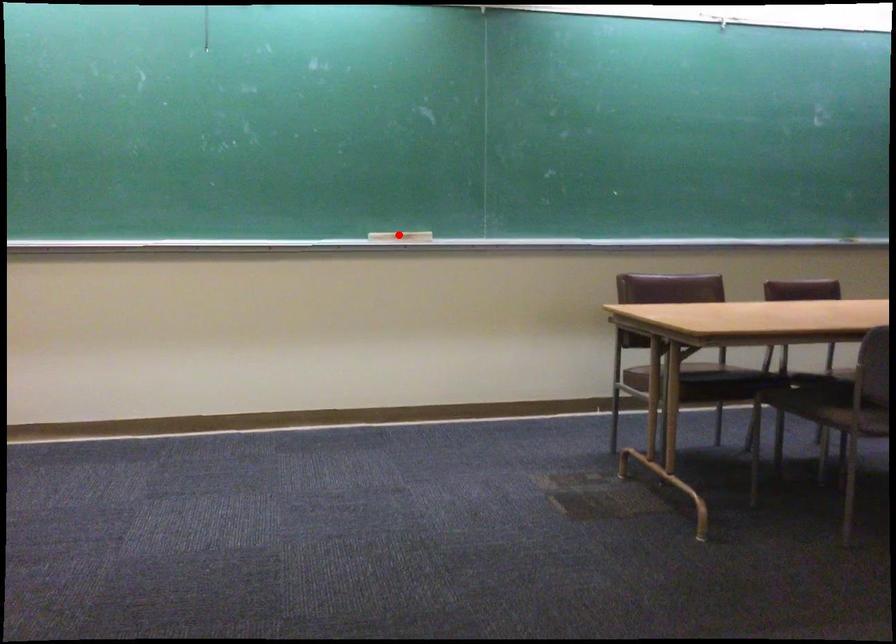
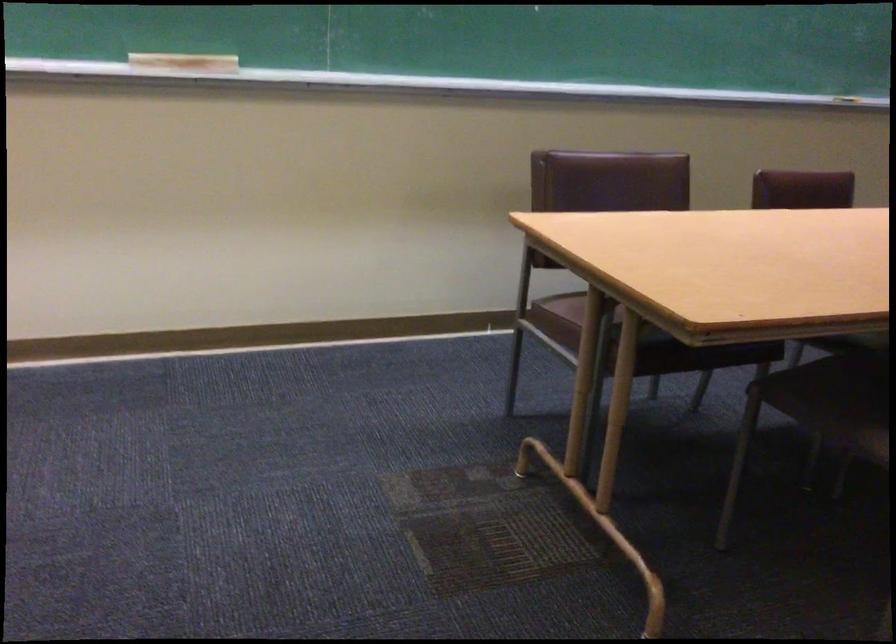
In the second image, find the point that corresponds to the highlighted location in the first image.

(183, 64)